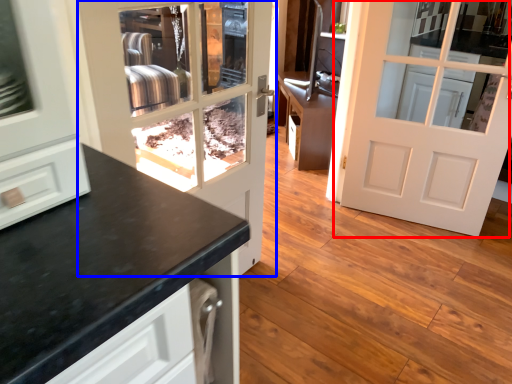
Question: Among these objects, which one is nearest to the camera, door (highlighted by a red box) or door (highlighted by a blue box)?

Choices:
 (A) door
 (B) door

Answer: (B)